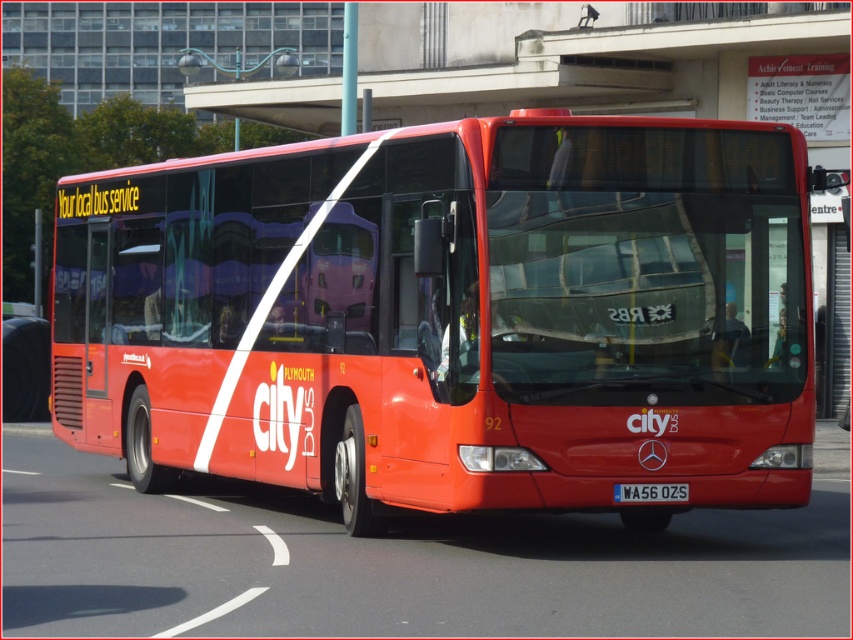
Question: Is shiny red bus at center above white plastic license plate at center?

Choices:
 (A) no
 (B) yes

Answer: (B)

Question: Is shiny red bus at center positioned at the back of white plastic license plate at center?

Choices:
 (A) yes
 (B) no

Answer: (B)

Question: Is the position of shiny red bus at center more distant than that of white plastic license plate at center?

Choices:
 (A) yes
 (B) no

Answer: (B)